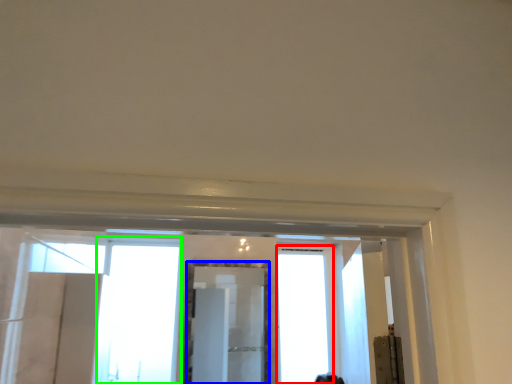
Question: Estimate the real-world distances between objects in this image. Which object is closer to window (highlighted by a red box), mirror (highlighted by a blue box) or window (highlighted by a green box)?

Choices:
 (A) mirror
 (B) window

Answer: (A)